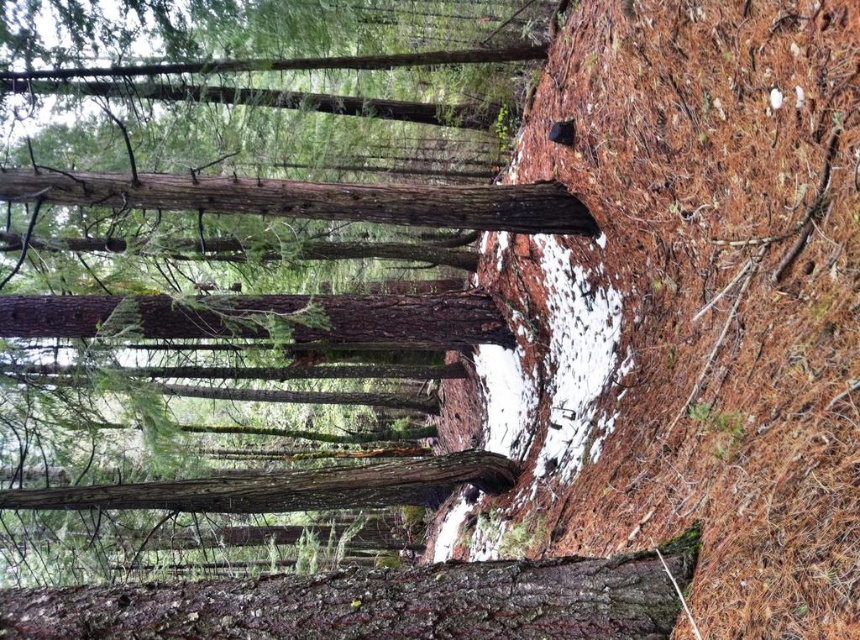
The height and width of the screenshot is (640, 860). Describe the element at coordinates (246, 260) in the screenshot. I see `smooth brown tree trunk at center` at that location.

Between smooth brown tree trunk at center and rough bark tree trunk at center, which one appears on the left side from the viewer's perspective?

smooth brown tree trunk at center

Between point (498, 150) and point (324, 620), which one is positioned in front?

Point (324, 620) is in front.

I want to click on smooth brown tree trunk at center, so click(x=246, y=260).

How far apart are brown/dry pine needles at lower right and rough bark tree trunk at center?

brown/dry pine needles at lower right and rough bark tree trunk at center are 6.58 feet apart from each other.

Who is positioned more to the left, brown/dry pine needles at lower right or rough bark tree trunk at center?

rough bark tree trunk at center is more to the left.

Is point (697, 506) farther from camera compared to point (637, 570)?

Yes.

Where is `brown/dry pine needles at lower right`? The width and height of the screenshot is (860, 640). brown/dry pine needles at lower right is located at coordinates (698, 305).

Is smooth brown tree trunk at center positioned before brown/dry pine needles at lower right?

No, it is behind brown/dry pine needles at lower right.

Does point (320, 65) come farther from viewer compared to point (812, 358)?

Yes, it is behind point (812, 358).

From the picture: Measure the distance between point (28, 211) and camera.

They are 7.97 meters apart.

Find the location of a particular element. smooth brown tree trunk at center is located at coordinates (246, 260).